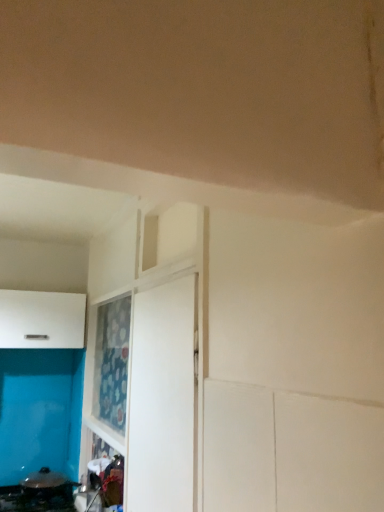
Question: From a real-world perspective, is white matte cabinet at left below black glossy pan at lower left?

Choices:
 (A) no
 (B) yes

Answer: (A)

Question: Is white matte cabinet at left positioned behind black glossy pan at lower left?

Choices:
 (A) yes
 (B) no

Answer: (A)

Question: Would you say white matte cabinet at left contains black glossy pan at lower left?

Choices:
 (A) yes
 (B) no

Answer: (B)

Question: From the image's perspective, is white matte cabinet at left located beneath black glossy pan at lower left?

Choices:
 (A) no
 (B) yes

Answer: (A)

Question: Are white matte cabinet at left and black glossy pan at lower left making contact?

Choices:
 (A) no
 (B) yes

Answer: (A)

Question: Is white matte cabinet at left positioned far away from black glossy pan at lower left?

Choices:
 (A) yes
 (B) no

Answer: (B)

Question: Is black glossy pan at lower left next to white matte door at center and touching it?

Choices:
 (A) yes
 (B) no

Answer: (B)

Question: Is black glossy pan at lower left oriented away from white matte door at center?

Choices:
 (A) yes
 (B) no

Answer: (B)

Question: Is black glossy pan at lower left positioned far away from white matte door at center?

Choices:
 (A) no
 (B) yes

Answer: (B)

Question: Can you confirm if black glossy pan at lower left is bigger than white matte door at center?

Choices:
 (A) yes
 (B) no

Answer: (A)

Question: Can we say black glossy pan at lower left lies outside white matte door at center?

Choices:
 (A) yes
 (B) no

Answer: (A)

Question: From the image's perspective, is black glossy pan at lower left located beneath white matte door at center?

Choices:
 (A) no
 (B) yes

Answer: (B)

Question: Does white matte cabinet at left have a lesser height compared to white matte door at center?

Choices:
 (A) no
 (B) yes

Answer: (B)